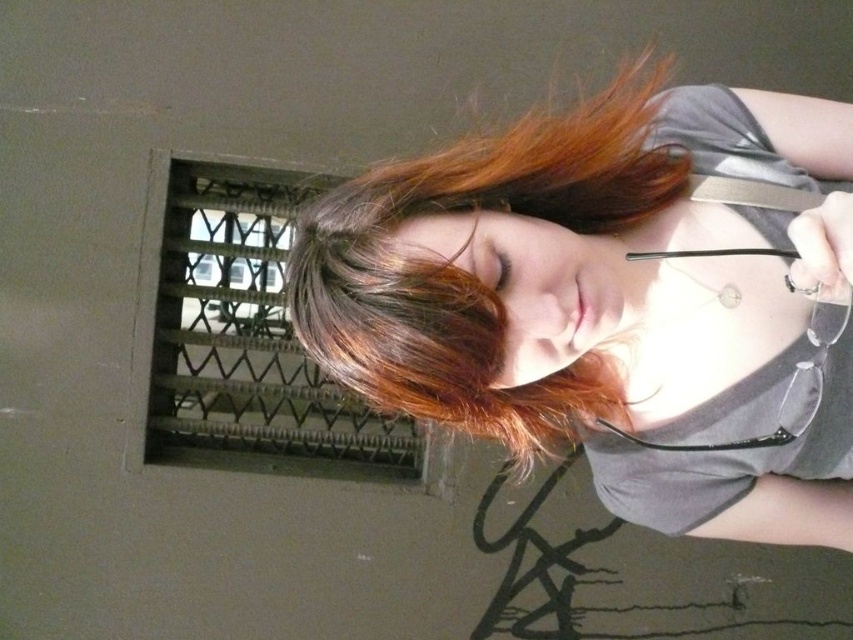
Question: Can you confirm if matte gray shirt at center is positioned to the left of shiny brown hair at center?

Choices:
 (A) no
 (B) yes

Answer: (A)

Question: Can you confirm if matte gray shirt at center is positioned above shiny brown hair at center?

Choices:
 (A) no
 (B) yes

Answer: (A)

Question: Does matte gray shirt at center appear on the right side of shiny brown hair at center?

Choices:
 (A) yes
 (B) no

Answer: (A)

Question: Among these objects, which one is farthest from the camera?

Choices:
 (A) matte gray shirt at center
 (B) shiny brown hair at center

Answer: (A)

Question: Which object is closer to the camera taking this photo?

Choices:
 (A) matte gray shirt at center
 (B) shiny brown hair at center

Answer: (B)

Question: Which point is farther to the camera?

Choices:
 (A) (663, 410)
 (B) (374, 273)

Answer: (A)